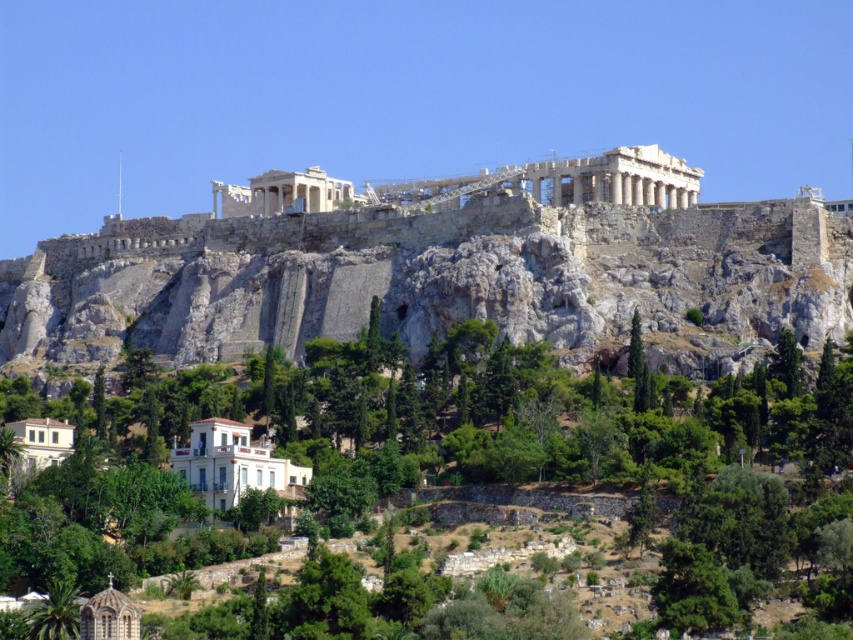
Is rugged stone mountain at center closer to the viewer compared to green leafy tree at center?

No, rugged stone mountain at center is behind green leafy tree at center.

Can you confirm if rugged stone mountain at center is positioned to the right of green leafy tree at center?

No, rugged stone mountain at center is not to the right of green leafy tree at center.

Who is more distant from viewer, (637, 301) or (544, 346)?

The point (637, 301) is more distant.

Locate an element on the screen. This screenshot has height=640, width=853. rugged stone mountain at center is located at coordinates (434, 282).